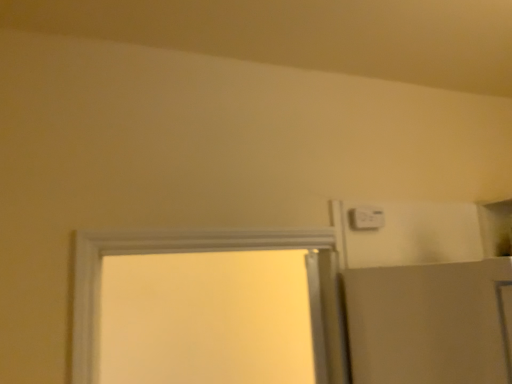
Measure the distance between point (352,216) and camera.

Point (352,216) and camera are 1.40 meters apart.

At what (x,y) coordinates should I click in order to perform the action: click on white plastic light switch at upper right. Please return your answer as a coordinate pair (x, y). The width and height of the screenshot is (512, 384). Looking at the image, I should click on (366, 218).

The width and height of the screenshot is (512, 384). Describe the element at coordinates (366, 218) in the screenshot. I see `white plastic light switch at upper right` at that location.

You are a GUI agent. You are given a task and a screenshot of the screen. Output one action in this format:
    pyautogui.click(x=<x>, y=<y>)
    Task: Click on the white plastic light switch at upper right
    The width and height of the screenshot is (512, 384).
    Given the screenshot: What is the action you would take?
    pyautogui.click(x=366, y=218)